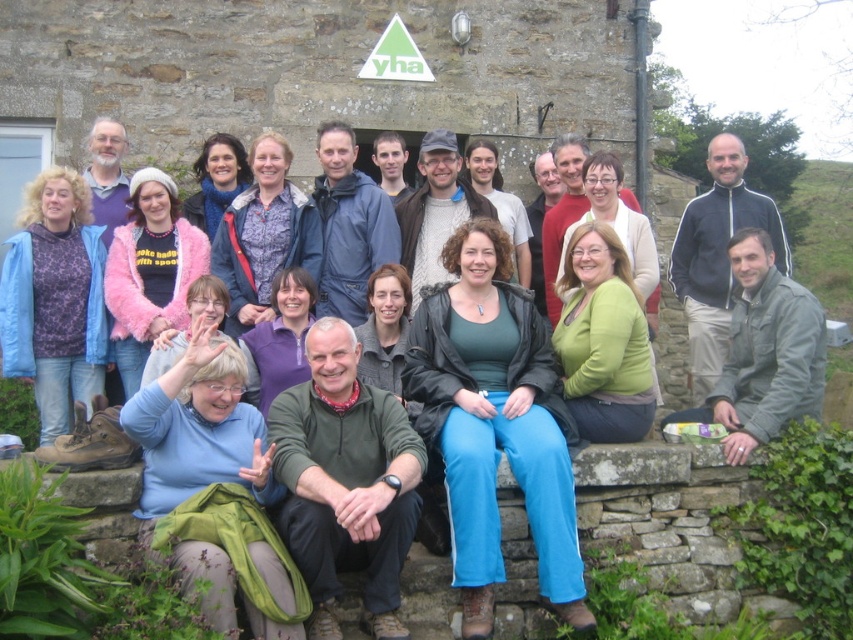
Between blue fleece jacket at lower left and knitted sweater at center, which one is positioned lower?

blue fleece jacket at lower left is lower down.

Image resolution: width=853 pixels, height=640 pixels. Identify the location of blue fleece jacket at lower left. (55, 300).

What are the coordinates of `blue fleece jacket at lower left` in the screenshot? It's located at (55, 300).

At what (x,y) coordinates should I click in order to perform the action: click on gray fabric jacket at lower right. Please return your answer as a coordinate pair (x, y). The height and width of the screenshot is (640, 853). Looking at the image, I should click on (764, 353).

I want to click on gray fabric jacket at lower right, so click(764, 353).

Is green fleece at center to the left of knitted sweater at center from the viewer's perspective?

Indeed, green fleece at center is positioned on the left side of knitted sweater at center.

Who is taller, green fleece at center or knitted sweater at center?

green fleece at center is taller.

You are a GUI agent. You are given a task and a screenshot of the screen. Output one action in this format:
    pyautogui.click(x=<x>, y=<y>)
    Task: Click on the green fleece at center
    The width and height of the screenshot is (853, 640).
    Given the screenshot: What is the action you would take?
    pyautogui.click(x=345, y=481)